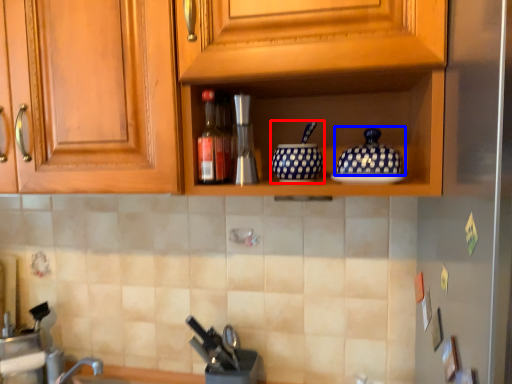
Question: Which point is further to the camera, tableware (highlighted by a red box) or pottery (highlighted by a blue box)?

Choices:
 (A) tableware
 (B) pottery

Answer: (A)